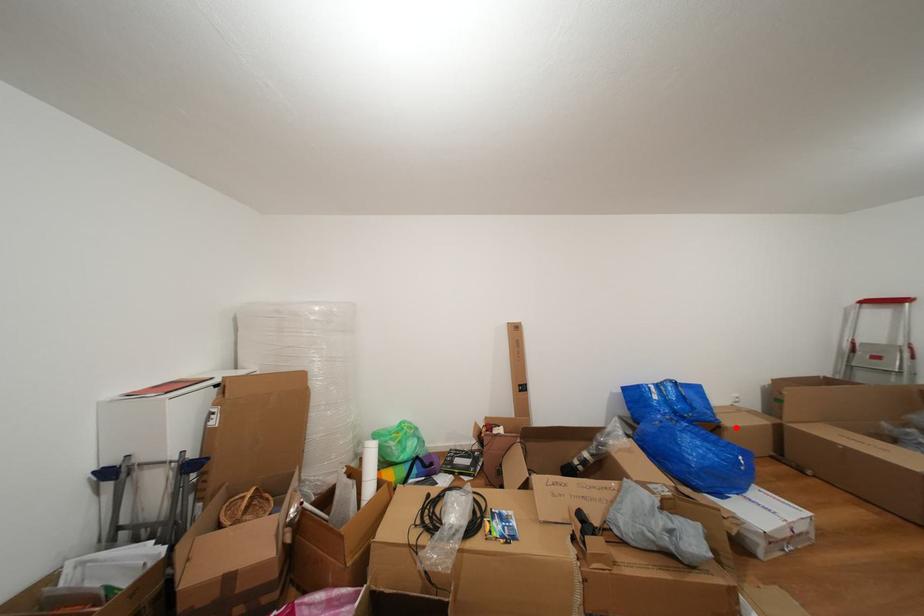
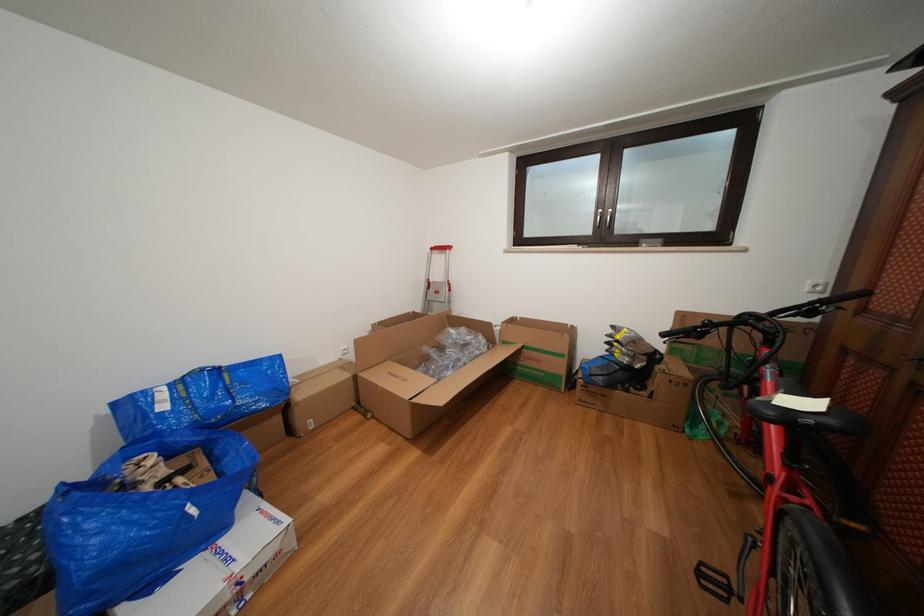
Question: A red point is marked in image1. In image2, is the corresponding 3D point closer to the camera or farther? Reply with the corresponding letter.

Choices:
 (A) The corresponding 3D point is closer.
 (B) The corresponding 3D point is farther.

Answer: (A)